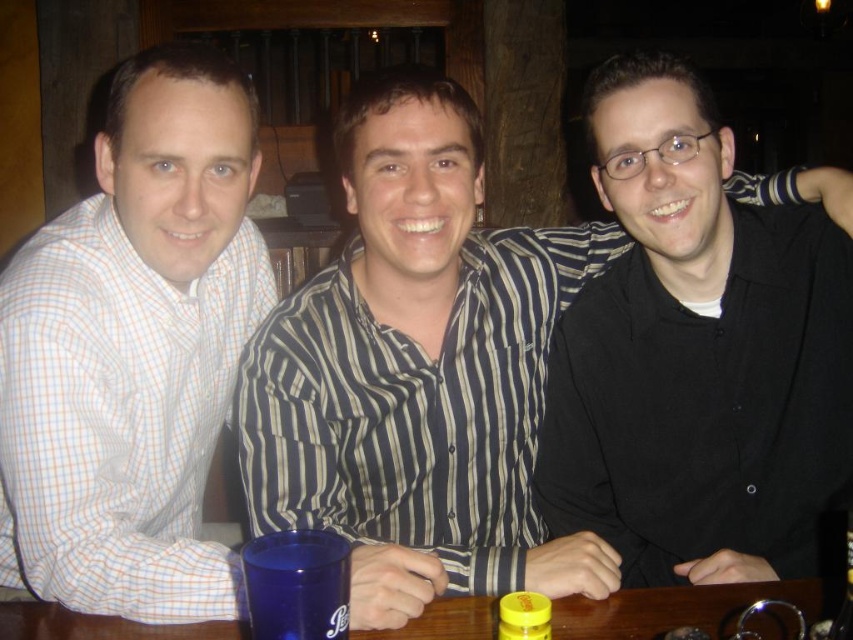
Between black matte shirt at center and yellow matte jar at lower center, which one appears on the right side from the viewer's perspective?

Positioned to the right is black matte shirt at center.

Can you confirm if black matte shirt at center is positioned above yellow matte jar at lower center?

Indeed, black matte shirt at center is positioned over yellow matte jar at lower center.

From the picture: Who is more forward, (660,253) or (527,614)?

Point (527,614) is more forward.

The height and width of the screenshot is (640, 853). Find the location of `black matte shirt at center`. black matte shirt at center is located at coordinates (695, 355).

Can you confirm if striped shirt at center is positioned to the left of black matte shirt at center?

Correct, you'll find striped shirt at center to the left of black matte shirt at center.

Consider the image. Can you confirm if striped shirt at center is taller than black matte shirt at center?

Incorrect, striped shirt at center's height is not larger of black matte shirt at center's.

Does point (451, 232) lie behind point (693, 317)?

No, (451, 232) is in front of (693, 317).

The width and height of the screenshot is (853, 640). I want to click on striped shirt at center, so tap(419, 358).

Between light blue checkered shirt at left and yellow matte jar at lower center, which one is positioned higher?

light blue checkered shirt at left

Is light blue checkered shirt at left positioned at the back of yellow matte jar at lower center?

That is True.

Locate an element on the screen. This screenshot has width=853, height=640. light blue checkered shirt at left is located at coordinates (132, 349).